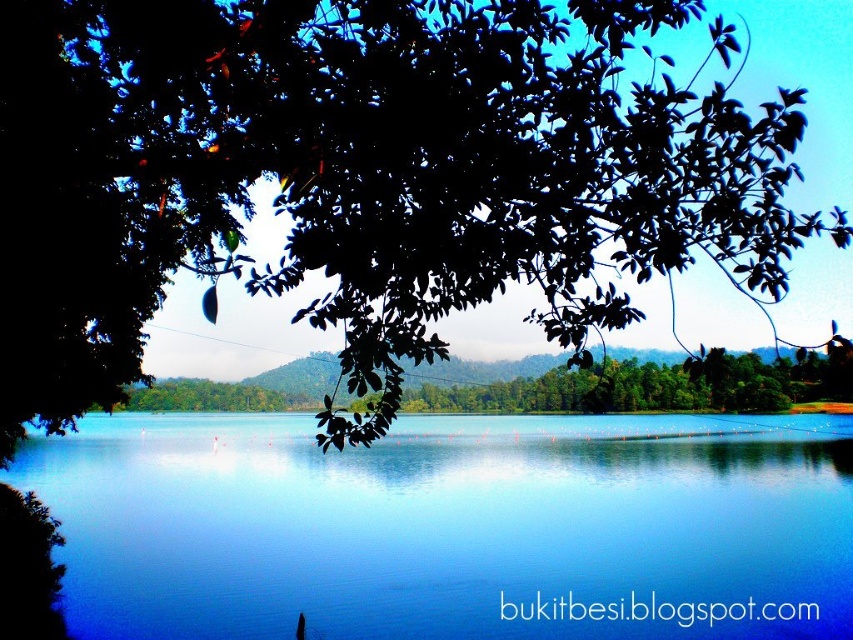
Question: Does green leafy tree at upper left have a greater width compared to green leafy tree at center?

Choices:
 (A) no
 (B) yes

Answer: (B)

Question: Which of the following is the closest to the observer?

Choices:
 (A) green leafy tree at center
 (B) transparent blue water at center

Answer: (A)

Question: Estimate the real-world distances between objects in this image. Which object is farther from the green leafy tree at center?

Choices:
 (A) green leafy tree at upper left
 (B) transparent blue water at center

Answer: (A)

Question: Can you confirm if transparent blue water at center is thinner than green leafy tree at center?

Choices:
 (A) no
 (B) yes

Answer: (A)

Question: Is green leafy tree at upper left above green leafy tree at center?

Choices:
 (A) yes
 (B) no

Answer: (A)

Question: Considering the real-world distances, which object is closest to the transparent blue water at center?

Choices:
 (A) green leafy tree at upper left
 (B) green leafy tree at center

Answer: (B)